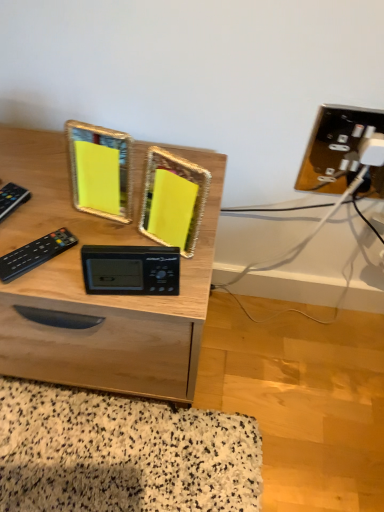
Locate an element on the screen. vacant area that is situated to the right of wooden desk at center is located at coordinates (282, 382).